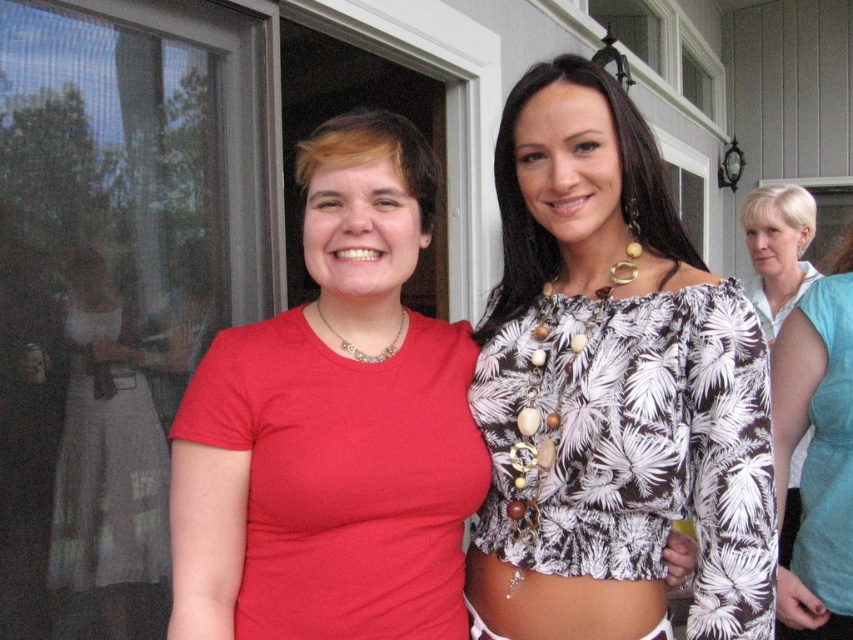
Between white lace dress at left and teal fabric dress at right, which one appears on the left side from the viewer's perspective?

Positioned to the left is white lace dress at left.

What do you see at coordinates (107, 464) in the screenshot? I see `white lace dress at left` at bounding box center [107, 464].

You are a GUI agent. You are given a task and a screenshot of the screen. Output one action in this format:
    pyautogui.click(x=<x>, y=<y>)
    Task: Click on the white lace dress at left
    The height and width of the screenshot is (640, 853).
    Given the screenshot: What is the action you would take?
    pyautogui.click(x=107, y=464)

Who is higher up, transparent glass screen door at upper center or light blue fabric dress at right?

Positioned higher is transparent glass screen door at upper center.

Can you confirm if transparent glass screen door at upper center is positioned to the right of light blue fabric dress at right?

In fact, transparent glass screen door at upper center is to the left of light blue fabric dress at right.

Image resolution: width=853 pixels, height=640 pixels. Identify the location of transparent glass screen door at upper center. (445, 100).

Find the location of a particular element. Image resolution: width=853 pixels, height=640 pixels. transparent glass screen door at upper center is located at coordinates (445, 100).

Who is more forward, (334, 628) or (114, 340)?

Point (334, 628) is more forward.

Can you confirm if matte red t-shirt at center is thinner than white lace dress at left?

No.

Which is in front, point (184, 497) or point (151, 525)?

Point (184, 497) is in front.

Where is `matte red t-shirt at center`? This screenshot has height=640, width=853. matte red t-shirt at center is located at coordinates (334, 426).